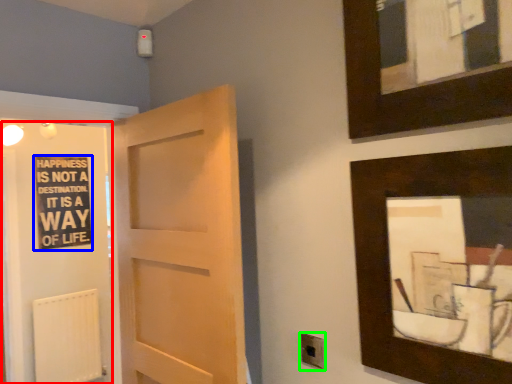
Question: Considering the real-world distances, which object is farthest from elevator (highlighted by a red box)? bulletin board (highlighted by a blue box) or electric outlet (highlighted by a green box)?

Choices:
 (A) bulletin board
 (B) electric outlet

Answer: (B)